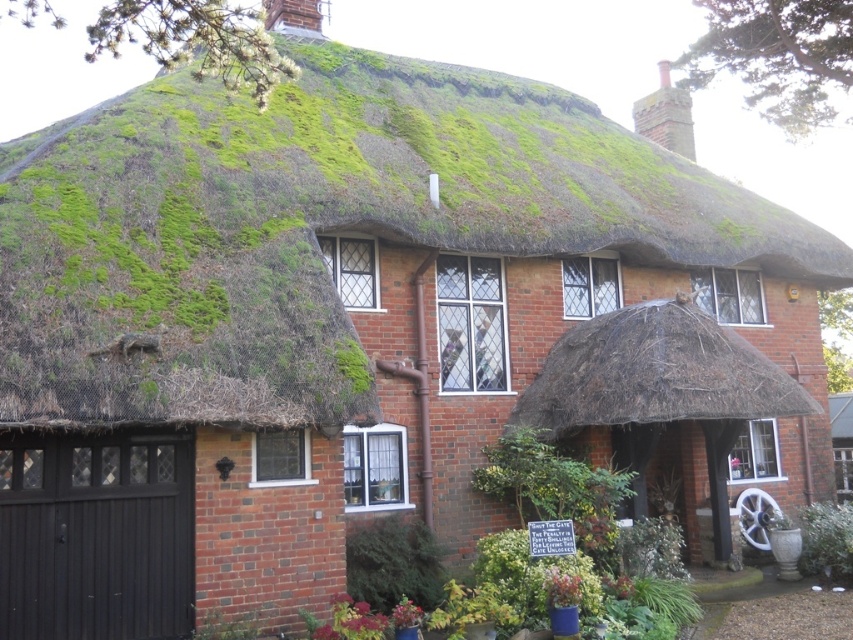
Based on the photo, please provide the 2D coordinates of the brown thatch roof at center in the image.

The brown thatch roof at center is located at coordinates (656,376).

You are standing in front of the brick house and notice two points marked on the garage door. The first point is at coordinates point (817, 408) and the second is at point (822, 525). Which point is closer to you?

Point (817, 408) is closer to the viewer than point (822, 525).

You are standing in front of the brick house and notice the brown thatch roof at center and the green leafy plant at lower right. Which object is positioned higher relative to the other?

The brown thatch roof at center is located above the green leafy plant at lower right, so the brown thatch roof at center is higher.